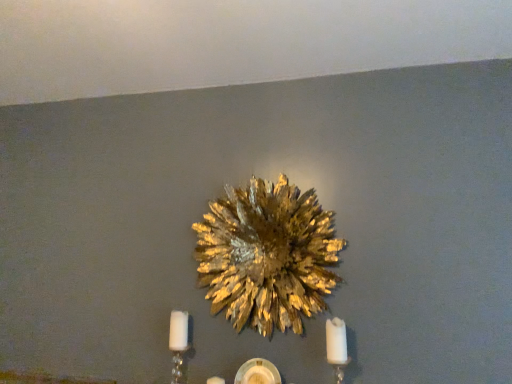
Question: Can you confirm if white matte candle at lower right is bigger than white crystal candle holder at lower left?

Choices:
 (A) yes
 (B) no

Answer: (A)

Question: Is white matte candle at lower right far away from white crystal candle holder at lower left?

Choices:
 (A) no
 (B) yes

Answer: (A)

Question: Is white crystal candle holder at lower left located within white matte candle at lower right?

Choices:
 (A) no
 (B) yes

Answer: (A)

Question: From the image's perspective, is white matte candle at lower right below white crystal candle holder at lower left?

Choices:
 (A) no
 (B) yes

Answer: (A)

Question: Does white matte candle at lower right come in front of white crystal candle holder at lower left?

Choices:
 (A) yes
 (B) no

Answer: (A)

Question: Can you confirm if white matte candle at lower right is wider than white crystal candle holder at lower left?

Choices:
 (A) yes
 (B) no

Answer: (A)

Question: Is gold metallic flower at center bigger than white matte candle at lower right?

Choices:
 (A) yes
 (B) no

Answer: (A)

Question: Is gold metallic flower at center positioned with its back to white matte candle at lower right?

Choices:
 (A) no
 (B) yes

Answer: (A)

Question: Considering the relative sizes of gold metallic flower at center and white matte candle at lower right in the image provided, is gold metallic flower at center taller than white matte candle at lower right?

Choices:
 (A) yes
 (B) no

Answer: (A)

Question: Is gold metallic flower at center far from white matte candle at lower right?

Choices:
 (A) no
 (B) yes

Answer: (A)

Question: Are gold metallic flower at center and white matte candle at lower right beside each other?

Choices:
 (A) yes
 (B) no

Answer: (B)

Question: Could you tell me if gold metallic flower at center is facing white matte candle at lower right?

Choices:
 (A) yes
 (B) no

Answer: (B)

Question: Considering the relative sizes of white crystal candle holder at lower left and white matte candle at lower right in the image provided, is white crystal candle holder at lower left wider than white matte candle at lower right?

Choices:
 (A) yes
 (B) no

Answer: (B)